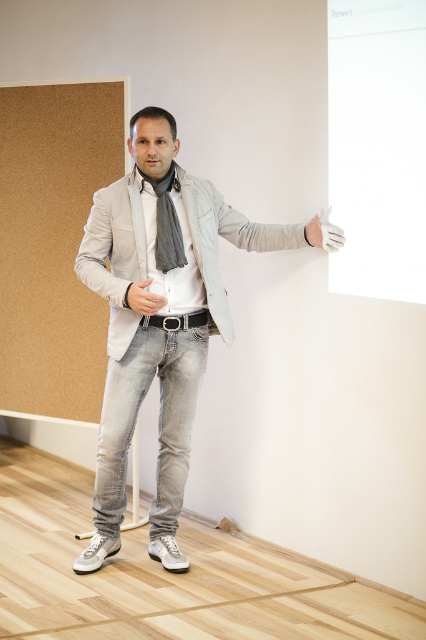
Which is above, white matte glove at upper right or matte gray glove at center?

white matte glove at upper right is higher up.

In the scene shown: Does white matte glove at upper right have a larger size compared to matte gray glove at center?

Indeed, white matte glove at upper right has a larger size compared to matte gray glove at center.

Between point (304, 232) and point (129, 298), which one is positioned in front?

Positioned in front is point (129, 298).

The width and height of the screenshot is (426, 640). Identify the location of white matte glove at upper right. (324, 232).

Can you confirm if white glossy board at upper right is shorter than white matte glove at upper right?

In fact, white glossy board at upper right may be taller than white matte glove at upper right.

Which is above, white glossy board at upper right or white matte glove at upper right?

Positioned higher is white glossy board at upper right.

Is point (416, 60) positioned behind point (325, 241)?

That is False.

You are a GUI agent. You are given a task and a screenshot of the screen. Output one action in this format:
    pyautogui.click(x=<x>, y=<y>)
    Task: Click on the white glossy board at upper right
    
    Given the screenshot: What is the action you would take?
    pyautogui.click(x=377, y=147)

Is gray fabric scarf at center below matte gray glove at center?

No, gray fabric scarf at center is not below matte gray glove at center.

The height and width of the screenshot is (640, 426). I want to click on gray fabric scarf at center, so click(x=166, y=221).